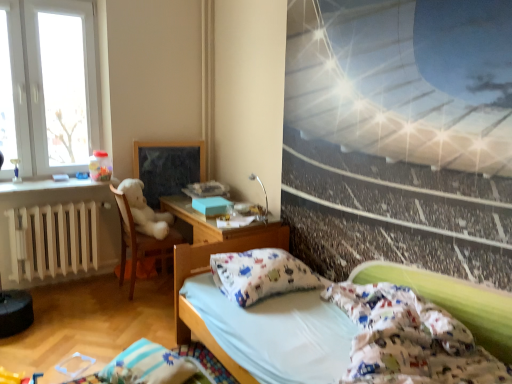
Where is `free space above white matte radiator at left (from a real-world perspective)`? The height and width of the screenshot is (384, 512). free space above white matte radiator at left (from a real-world perspective) is located at coordinates coord(50,201).